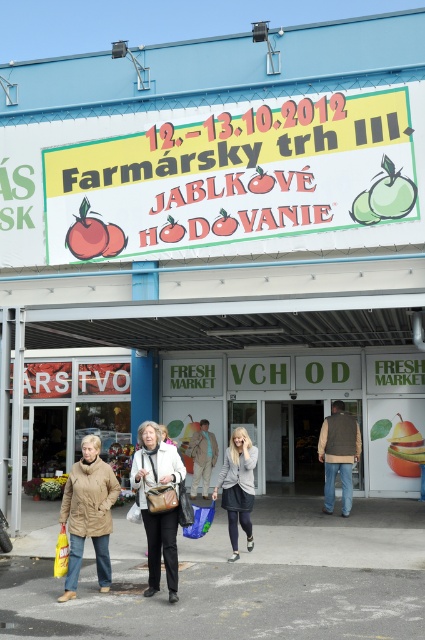
Question: Is yellow paper sign at upper center above leather handbag at center?

Choices:
 (A) yes
 (B) no

Answer: (A)

Question: Which of the following is the farthest from the observer?

Choices:
 (A) gray woolen sweater at center
 (B) beige wool coat at center
 (C) yellow matte apple at center
 (D) brown suede vest at center

Answer: (C)

Question: Is beige wool coat at center to the left of yellow matte apple at center from the viewer's perspective?

Choices:
 (A) yes
 (B) no

Answer: (A)

Question: Is beige wool coat at center below yellow matte apple at center?

Choices:
 (A) yes
 (B) no

Answer: (B)

Question: Which object is positioned closest to the beige wool coat at center?

Choices:
 (A) light brown leather jacket at center
 (B) brown suede vest at center
 (C) yellow matte apple at center
 (D) gray woolen sweater at center

Answer: (D)

Question: Which of the following is the closest to the observer?

Choices:
 (A) beige wool coat at center
 (B) leather handbag at center
 (C) yellow paper sign at upper center
 (D) gray woolen sweater at center

Answer: (B)